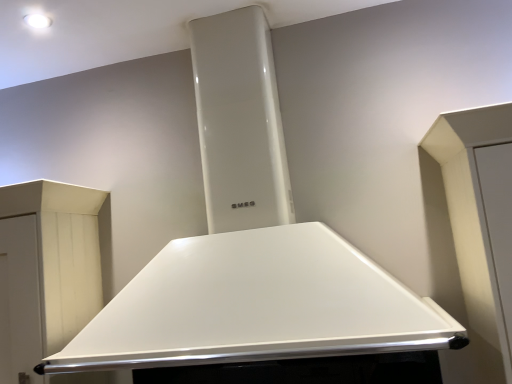
This screenshot has height=384, width=512. In order to click on white matte cabinet at left in this screenshot , I will do `click(46, 271)`.

Describe the element at coordinates (46, 271) in the screenshot. This screenshot has width=512, height=384. I see `white matte cabinet at left` at that location.

Where is `white matte cabinet at left`? The image size is (512, 384). white matte cabinet at left is located at coordinates (46, 271).